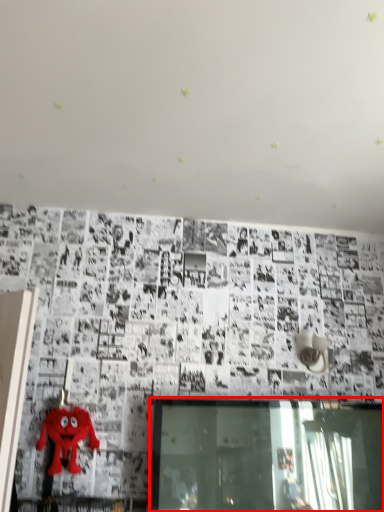
Question: From the image's perspective, where is window (annotated by the red box) located in relation to toy in the image?

Choices:
 (A) above
 (B) below

Answer: (B)